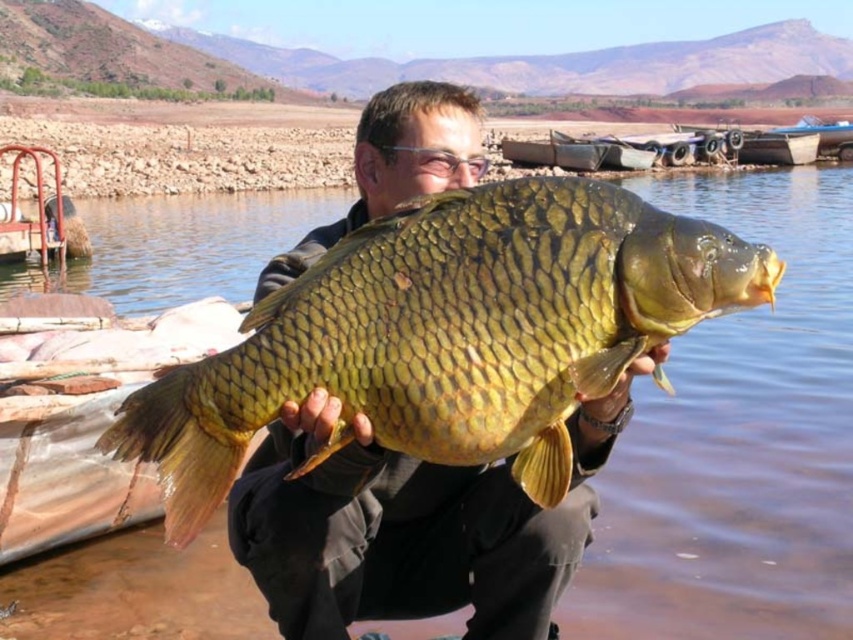
You are an observer looking at the man holding the fish. Which object, the shiny gold scales at center or the green scaly fish at center, is positioned closer to you?

The shiny gold scales at center is closer to the viewer than the green scaly fish at center.